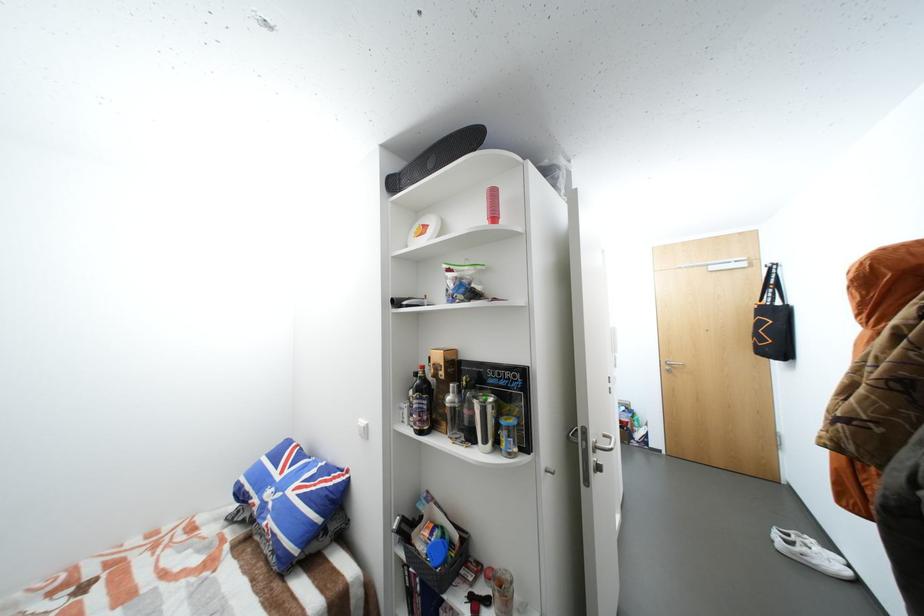
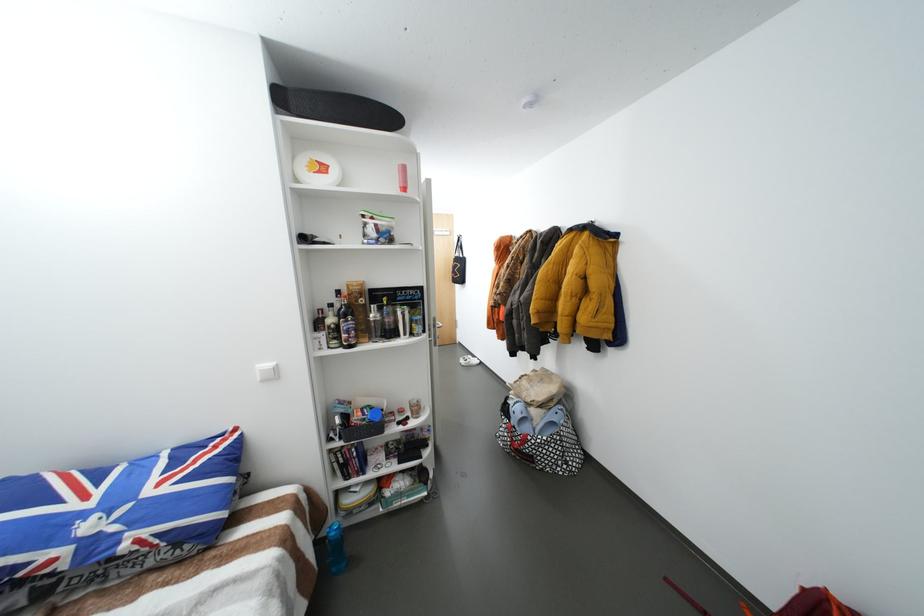
Question: The camera is either moving clockwise (left) or counter-clockwise (right) around the object. The first image is from the beginning of the video and the second image is from the end. Is the camera moving left or right when shooting the video?

Choices:
 (A) Left
 (B) Right

Answer: (A)